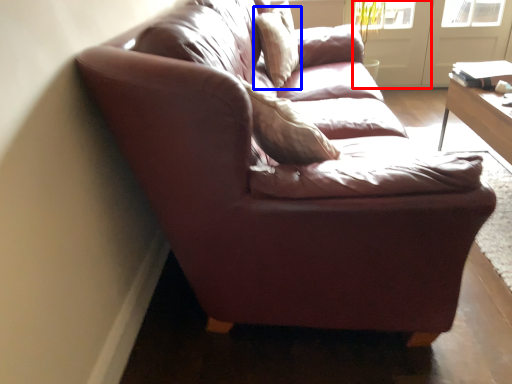
Question: Which object appears farthest to the camera in this image, screen door (highlighted by a red box) or pillow (highlighted by a blue box)?

Choices:
 (A) screen door
 (B) pillow

Answer: (A)